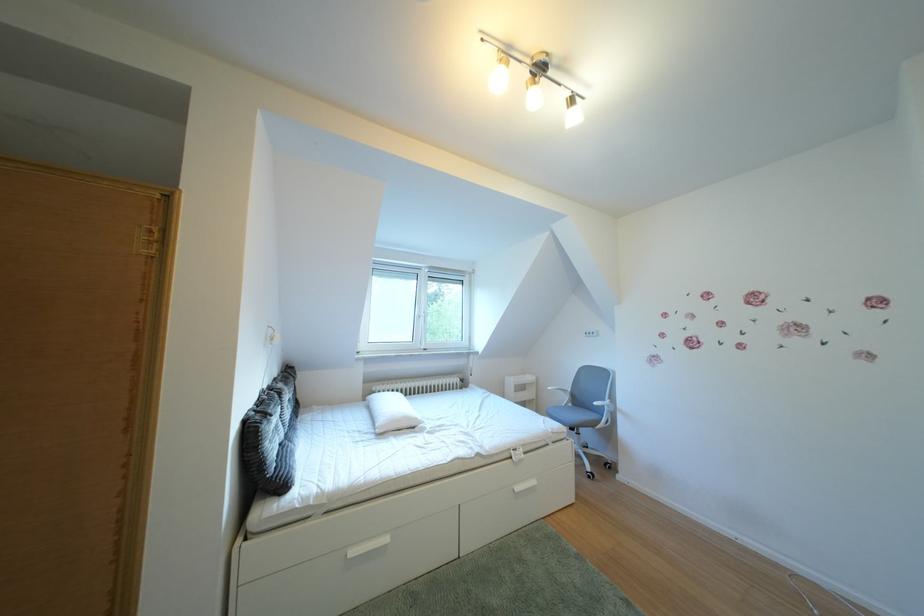
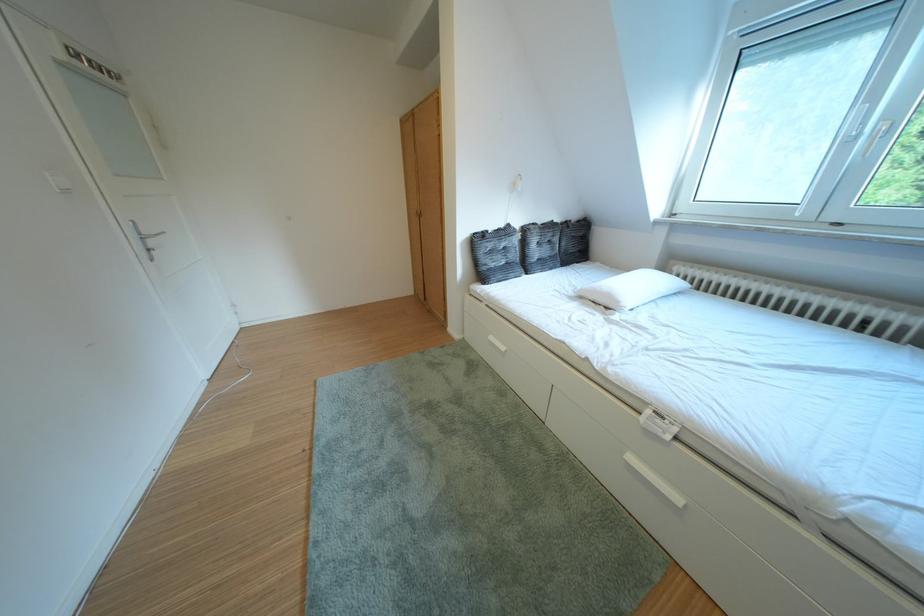
Locate, in the second image, the point that corresponds to point 530,493 in the first image.

(646, 464)